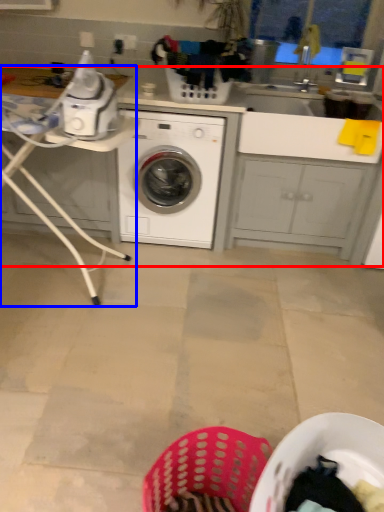
Question: Which point is further to the camera, counter top (highlighted by a red box) or table (highlighted by a blue box)?

Choices:
 (A) counter top
 (B) table

Answer: (A)